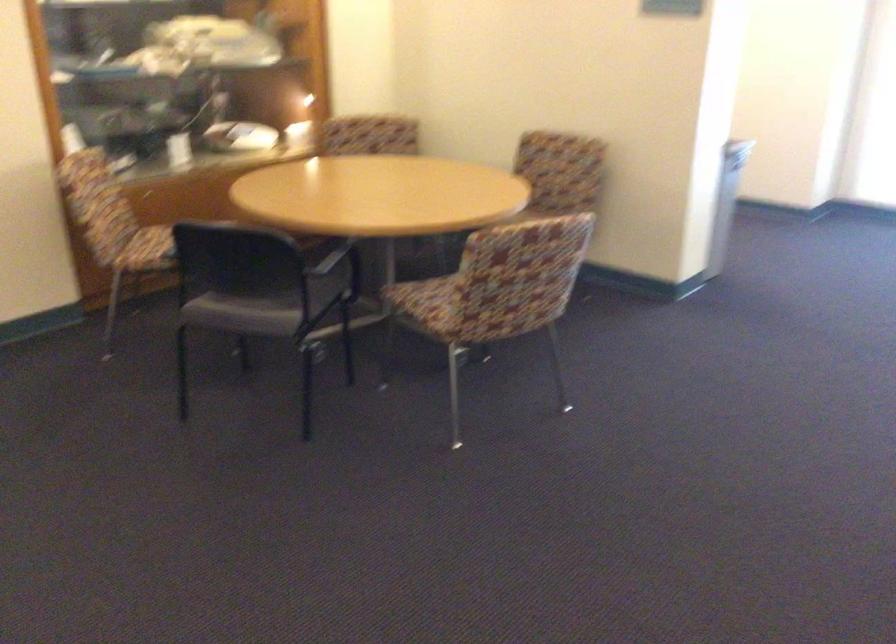
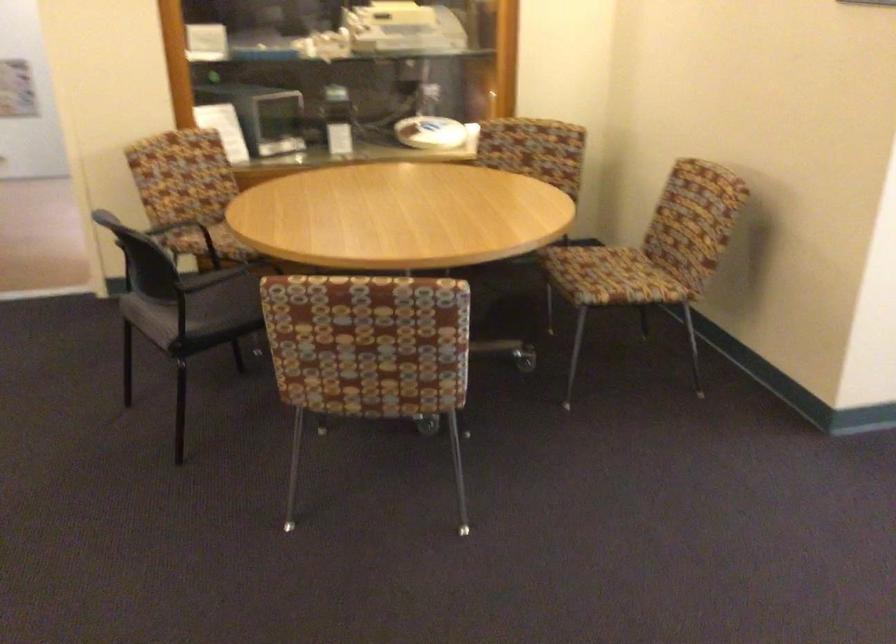
Find the pixel in the second image that matches [271,299] in the first image.

(213, 301)